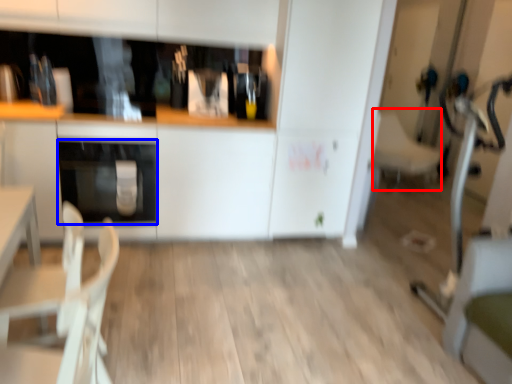
Question: Which object is closer to the camera taking this photo, armchair (highlighted by a red box) or oven (highlighted by a blue box)?

Choices:
 (A) armchair
 (B) oven

Answer: (B)